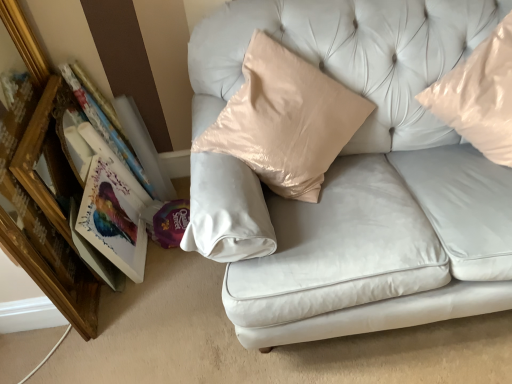
Question: Is satin white couch at center beside wooden picture frame at left?

Choices:
 (A) yes
 (B) no

Answer: (B)

Question: From the image's perspective, would you say satin white couch at center is positioned over wooden picture frame at left?

Choices:
 (A) yes
 (B) no

Answer: (A)

Question: From the image's perspective, is satin white couch at center beneath wooden picture frame at left?

Choices:
 (A) no
 (B) yes

Answer: (A)

Question: Is satin white couch at center positioned with its back to wooden picture frame at left?

Choices:
 (A) no
 (B) yes

Answer: (A)

Question: From a real-world perspective, is satin white couch at center physically below wooden picture frame at left?

Choices:
 (A) yes
 (B) no

Answer: (B)

Question: Is satin white couch at center not close to wooden picture frame at left?

Choices:
 (A) no
 (B) yes

Answer: (A)

Question: Is satin white couch at center smaller than matte cardboard book at left?

Choices:
 (A) no
 (B) yes

Answer: (A)

Question: Is satin white couch at center bigger than matte cardboard book at left?

Choices:
 (A) no
 (B) yes

Answer: (B)

Question: Does satin white couch at center come behind matte cardboard book at left?

Choices:
 (A) yes
 (B) no

Answer: (B)

Question: From a real-world perspective, is satin white couch at center below matte cardboard book at left?

Choices:
 (A) no
 (B) yes

Answer: (A)

Question: From a real-world perspective, does satin white couch at center stand above matte cardboard book at left?

Choices:
 (A) no
 (B) yes

Answer: (B)

Question: Can you confirm if satin white couch at center is positioned to the left of matte cardboard book at left?

Choices:
 (A) yes
 (B) no

Answer: (B)

Question: From a real-world perspective, is wooden picture frame at left positioned over matte paper book at left based on gravity?

Choices:
 (A) no
 (B) yes

Answer: (B)